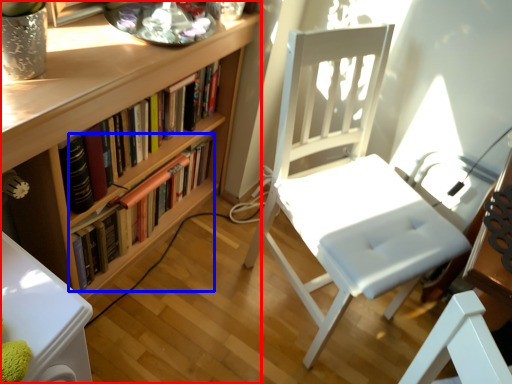
Question: Which object is further to the camera taking this photo, bookcase (highlighted by a red box) or book (highlighted by a blue box)?

Choices:
 (A) bookcase
 (B) book

Answer: (B)